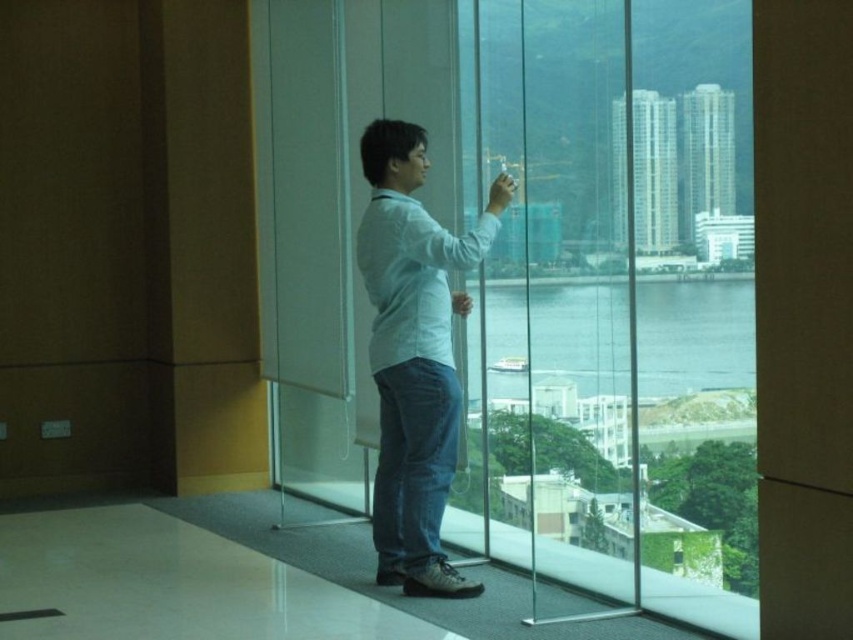
Is transparent glass door at center positioned before light blue denim jeans at center?

Yes, transparent glass door at center is in front of light blue denim jeans at center.

Does transparent glass door at center appear on the right side of light blue denim jeans at center?

Correct, you'll find transparent glass door at center to the right of light blue denim jeans at center.

You are a GUI agent. You are given a task and a screenshot of the screen. Output one action in this format:
    pyautogui.click(x=<x>, y=<y>)
    Task: Click on the transparent glass door at center
    
    Given the screenshot: What is the action you would take?
    pyautogui.click(x=618, y=301)